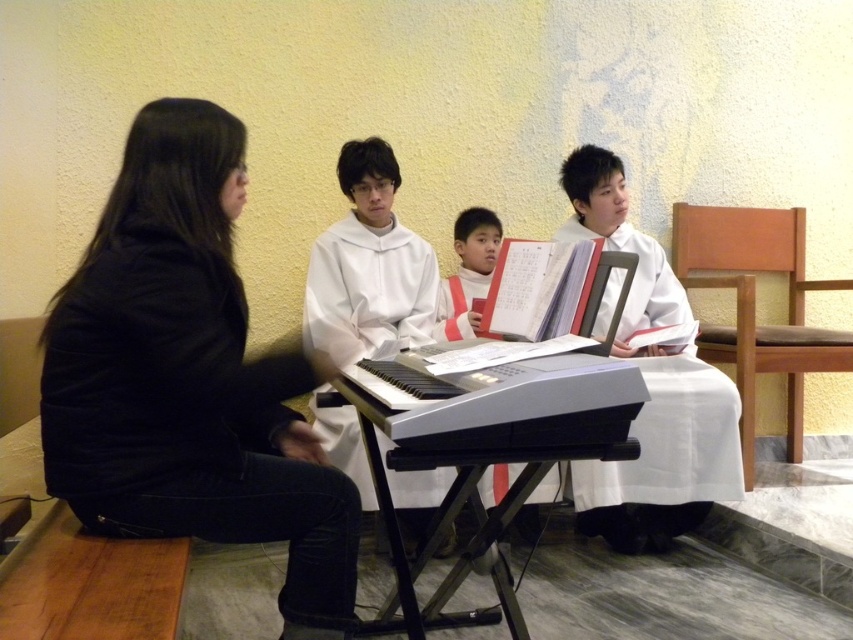
Is black plastic keyboard at center shorter than white matte/soft robe at center?

Correct, black plastic keyboard at center is not as tall as white matte/soft robe at center.

Does black plastic keyboard at center come in front of white matte/soft robe at center?

Yes, it is in front of white matte/soft robe at center.

Is point (456, 413) behind point (407, 269)?

No, (456, 413) is closer to viewer.

Locate an element on the screen. The width and height of the screenshot is (853, 640). black plastic keyboard at center is located at coordinates (506, 412).

Between brown leather chair at right and white paper at center, which one has more height?

brown leather chair at right is taller.

Can you confirm if brown leather chair at right is smaller than white paper at center?

Actually, brown leather chair at right might be larger than white paper at center.

Is point (801, 326) closer to camera compared to point (467, 228)?

No.

Find the location of `brown leather chair at right`. brown leather chair at right is located at coordinates (753, 307).

Who is more distant from viewer, (590, 499) or (485, 269)?

The point (485, 269) is behind.

Where is `white cloth at center`? The height and width of the screenshot is (640, 853). white cloth at center is located at coordinates (672, 440).